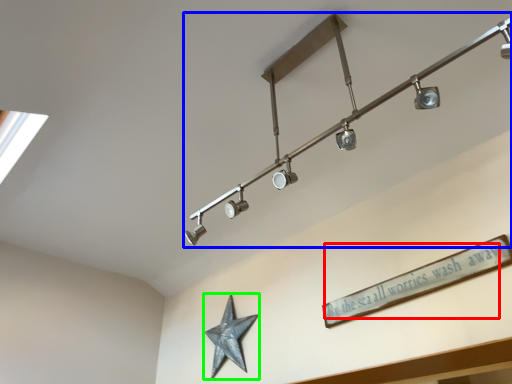
Question: Which object is positioned farthest from writing (highlighted by a red box)? Select from lamp (highlighted by a blue box) and star (highlighted by a green box).

Choices:
 (A) lamp
 (B) star

Answer: (B)